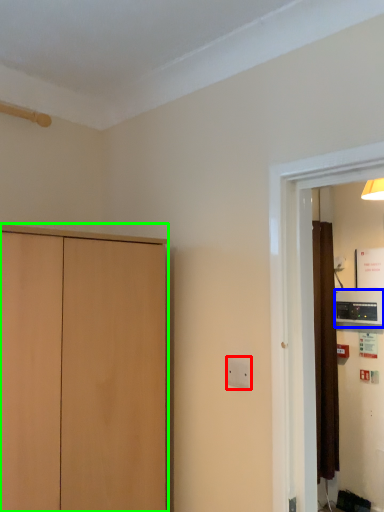
Question: Estimate the real-world distances between objects in this image. Which object is closer to electric outlet (highlighted by a red box), appliance (highlighted by a blue box) or cupboard (highlighted by a green box)?

Choices:
 (A) appliance
 (B) cupboard

Answer: (B)